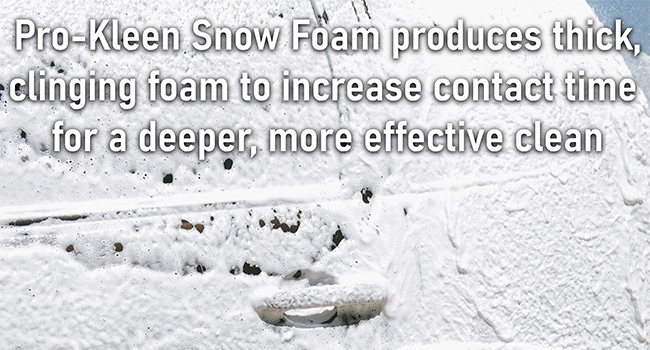
Find the location of `door handle`. door handle is located at coordinates (333, 313).